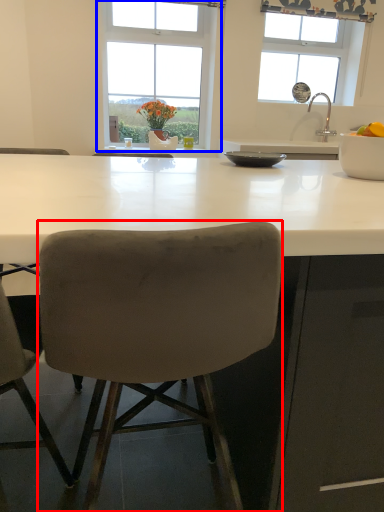
Question: Which of the following is the farthest to the observer, chair (highlighted by a red box) or window (highlighted by a blue box)?

Choices:
 (A) chair
 (B) window

Answer: (B)